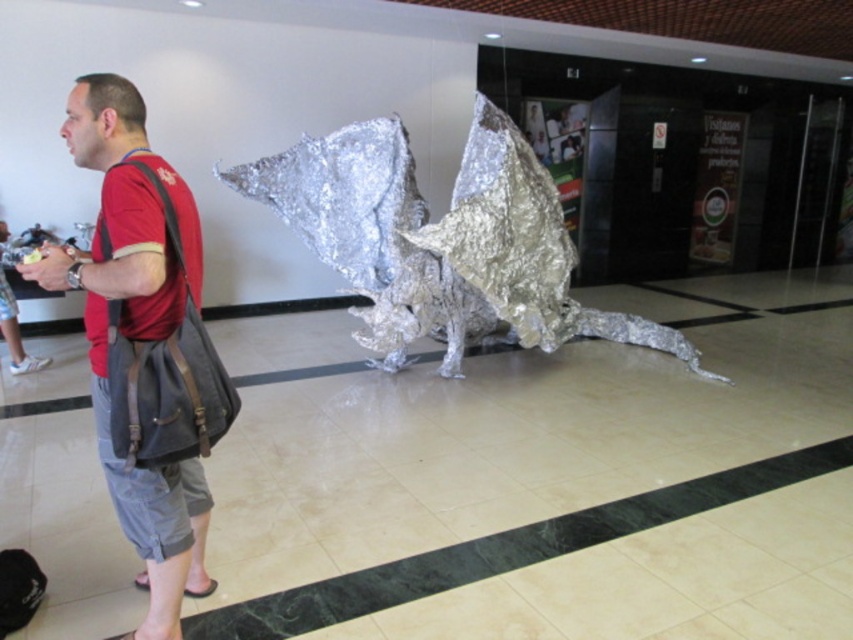
You are standing at point [103,74] and want to walk to point [299,205]. Is the dragon sculpture blocking your path?

Point [299,205] is behind point [103,74], so the dragon sculpture is blocking your path.